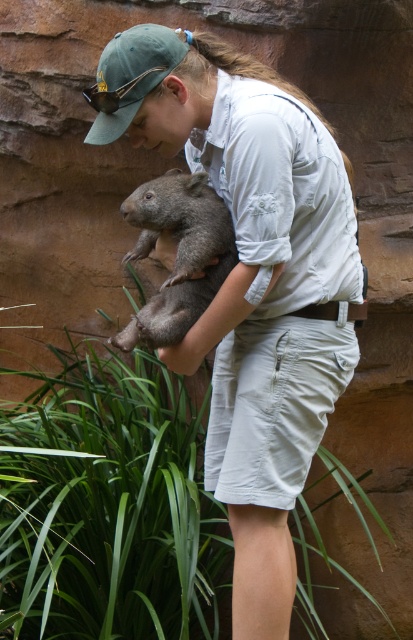
Which of these two, light gray cotton shirt at center or fuzzy gray wombat at center, stands shorter?

fuzzy gray wombat at center

Find the location of a particular element. The width and height of the screenshot is (413, 640). light gray cotton shirt at center is located at coordinates (251, 280).

Which is behind, point (166, 364) or point (204, 280)?

Point (166, 364)

Where is `light gray cotton shirt at center`? This screenshot has height=640, width=413. light gray cotton shirt at center is located at coordinates (251, 280).